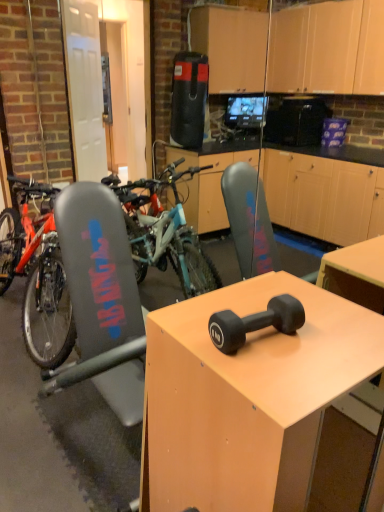
Locate an element on the screen. This screenshot has width=384, height=512. free space to the left of black rubber dumbbell at center is located at coordinates (187, 330).